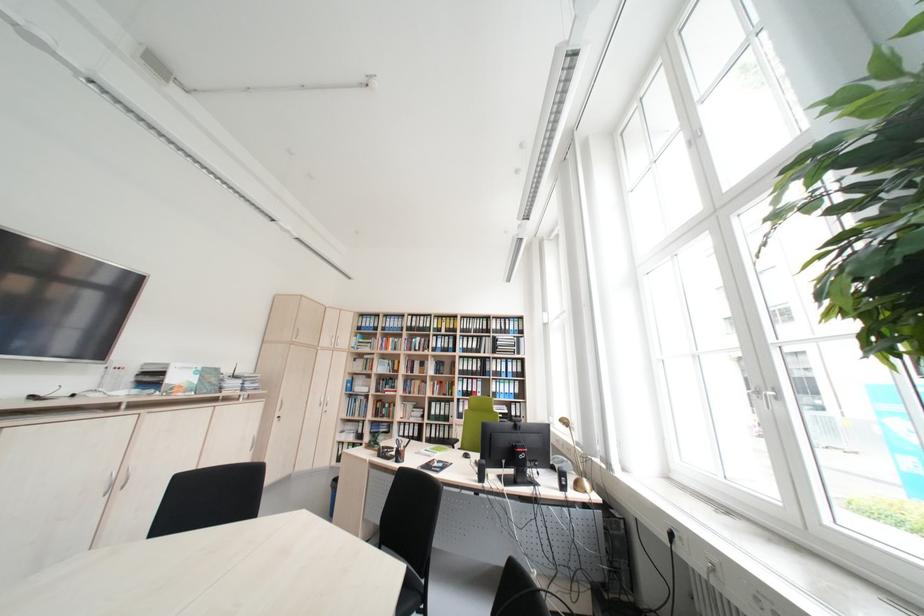
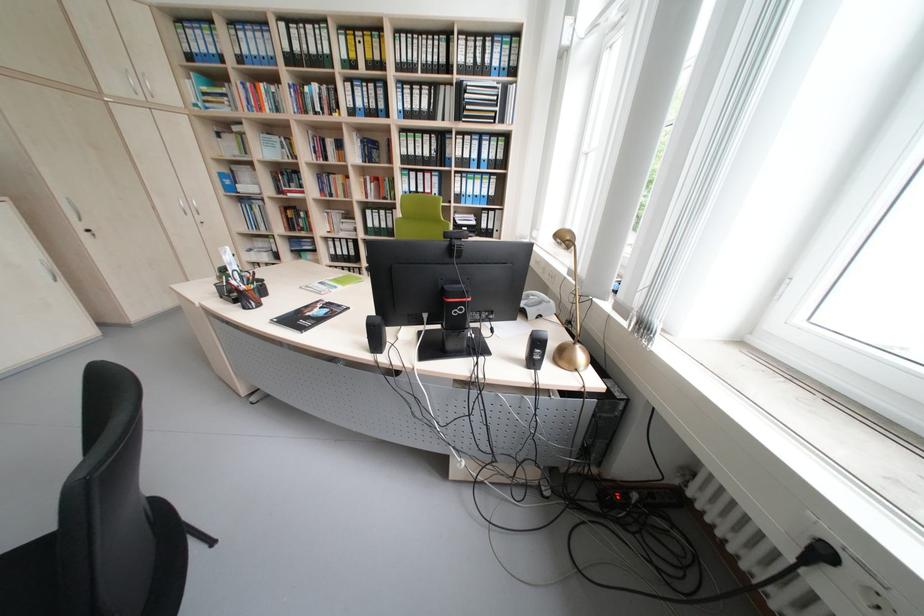
Where in the second image is the point corresponding to pixel 588 487 from the first image?

(573, 358)